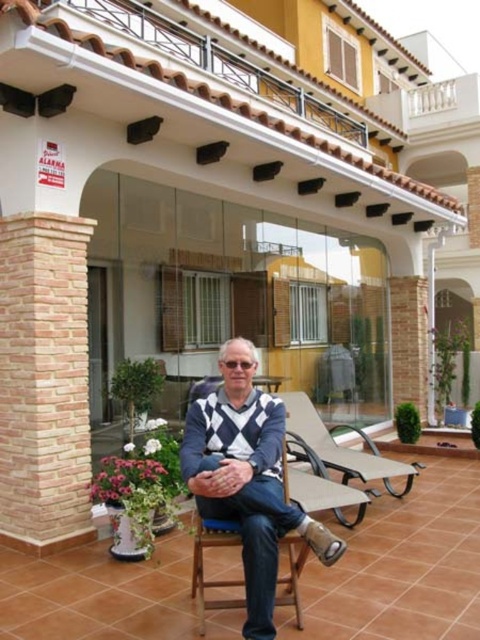
Consider the image. Is light brown brick pillar at left closer to the viewer compared to knitted sweater at center?

No, light brown brick pillar at left is further to the viewer.

Which is in front, point (86, 412) or point (248, 352)?

Point (248, 352)

Where is `light brown brick pillar at left`? The image size is (480, 640). light brown brick pillar at left is located at coordinates (44, 381).